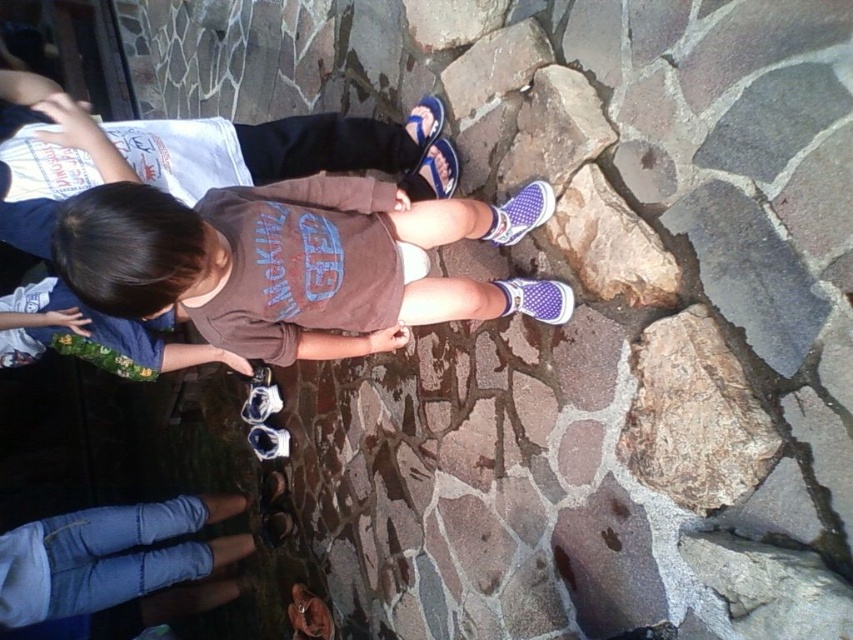
Does purple mesh sock at center have a lesser height compared to white fabric sock at center?

In fact, purple mesh sock at center may be taller than white fabric sock at center.

Measure the distance between purple mesh sock at center and camera.

A distance of 1.46 meters exists between purple mesh sock at center and camera.

Who is more forward, (564,304) or (412,269)?

Positioned in front is point (564,304).

Find the location of `purple mesh sock at center`. purple mesh sock at center is located at coordinates (538, 298).

Is point (445, 301) farther from viewer compared to point (425, 273)?

No, it is not.

Is point (383, 296) farther from viewer compared to point (407, 246)?

No.

The height and width of the screenshot is (640, 853). What are the coordinates of `brown cotton shirt at center` in the screenshot? It's located at (282, 259).

Is point (114, 282) positioned in front of point (520, 305)?

That is True.

Is point (440, 285) more distant than point (532, 292)?

No, it is in front of (532, 292).

In order to click on brown cotton shirt at center in this screenshot , I will do `click(282, 259)`.